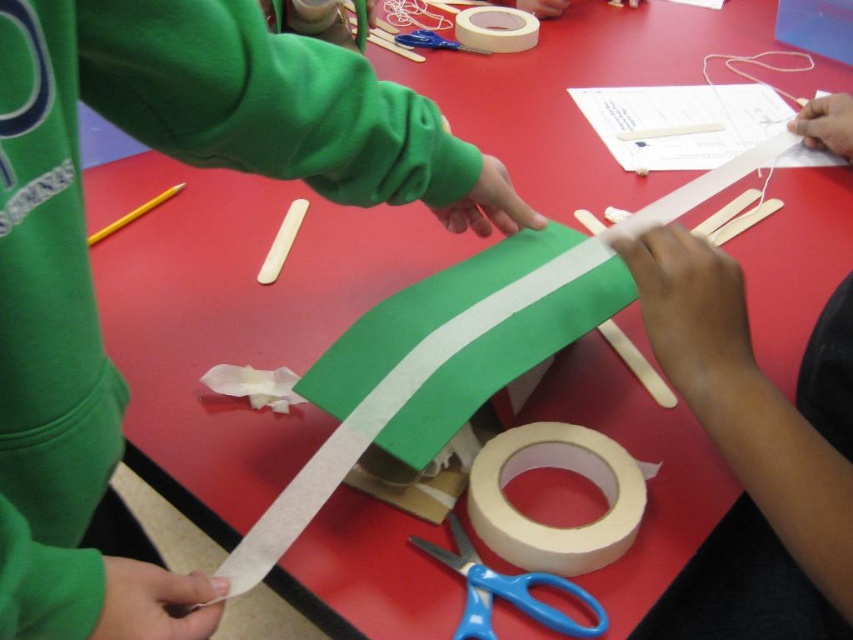
Is matte white tape at center shorter than white matte tape at upper center?

Correct, matte white tape at center is not as tall as white matte tape at upper center.

Who is higher up, matte white tape at center or white matte tape at upper center?

white matte tape at upper center is above.

Where is `matte white tape at center`? The height and width of the screenshot is (640, 853). matte white tape at center is located at coordinates (550, 525).

I want to click on matte white tape at center, so click(x=550, y=525).

Who is higher up, matte white tape at center or blue plastic scissors at lower center?

matte white tape at center is above.

Measure the distance between point (602, 552) and camera.

A distance of 58.66 centimeters exists between point (602, 552) and camera.

I want to click on matte white tape at center, so click(x=550, y=525).

Can you confirm if blue plastic scissors at lower center is smaller than white matte tape at upper center?

Correct, blue plastic scissors at lower center occupies less space than white matte tape at upper center.

Does point (473, 570) come behind point (532, 26)?

No, (473, 570) is in front of (532, 26).

Locate an element on the screen. The height and width of the screenshot is (640, 853). blue plastic scissors at lower center is located at coordinates (506, 592).